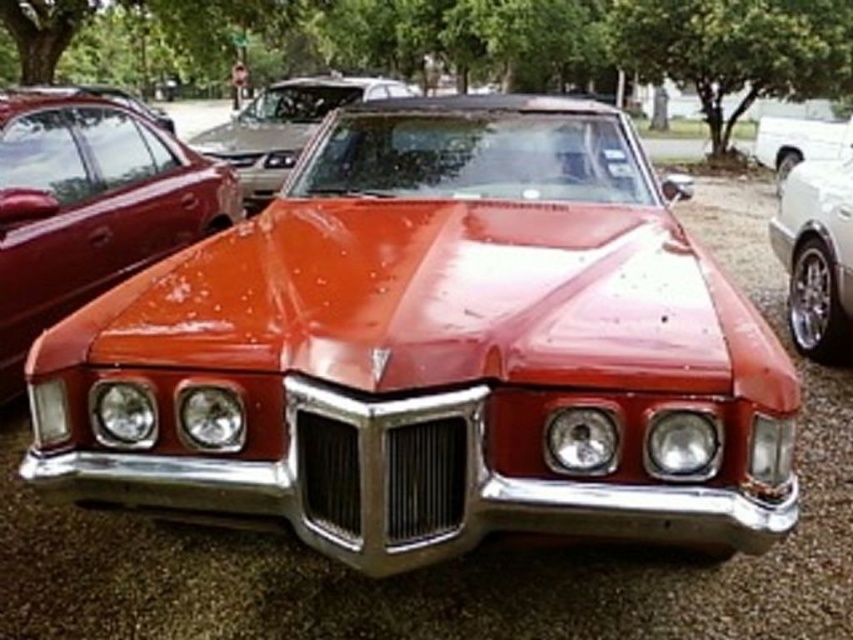
How far apart are glossy metallic car at right and glossy red car at center?

glossy metallic car at right is 6.26 meters away from glossy red car at center.

Is glossy metallic car at right further to the viewer compared to glossy red car at center?

No, glossy metallic car at right is closer to the viewer.

The image size is (853, 640). Describe the element at coordinates (816, 237) in the screenshot. I see `glossy metallic car at right` at that location.

Where is `glossy metallic car at right`? The width and height of the screenshot is (853, 640). glossy metallic car at right is located at coordinates (816, 237).

Where is `glossy metallic car at right`? The width and height of the screenshot is (853, 640). glossy metallic car at right is located at coordinates (816, 237).

Is the position of glossy metallic car at right more distant than that of shiny white truck at right?

No, it is not.

Between point (821, 164) and point (850, 125), which one is positioned behind?

The point (850, 125) is more distant.

Locate an element on the screen. The width and height of the screenshot is (853, 640). glossy metallic car at right is located at coordinates (816, 237).

Locate an element on the screen. glossy red car at center is located at coordinates (283, 125).

Is glossy red car at center taller than shiny white truck at right?

Indeed, glossy red car at center has a greater height compared to shiny white truck at right.

Where is `glossy red car at center`? glossy red car at center is located at coordinates (283, 125).

The image size is (853, 640). Find the location of `glossy red car at center`. glossy red car at center is located at coordinates (283, 125).